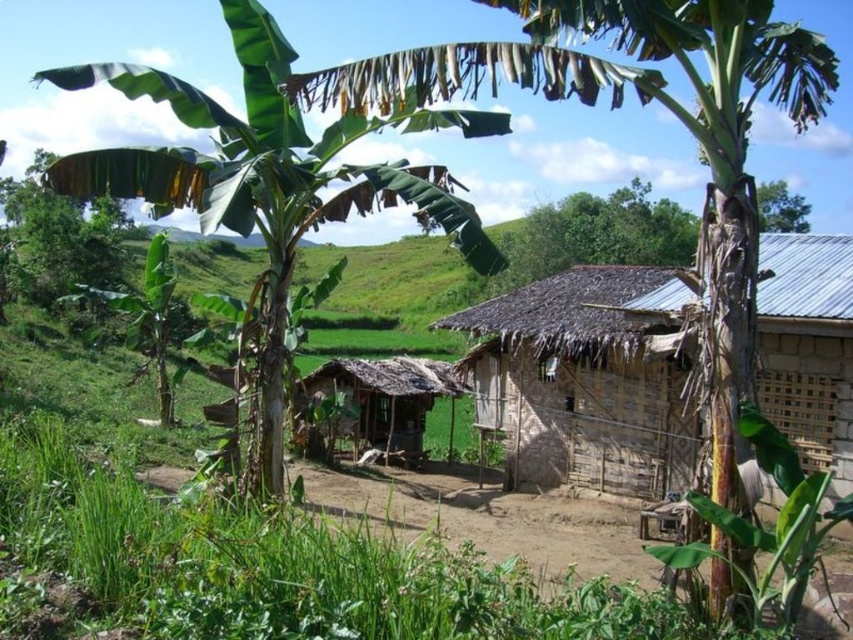
You are standing in the rural village and want to walk from the rusty corrugated metal hut at center to the green leafy tree at upper center. Which direction should you move towards?

You should move towards the right since the rusty corrugated metal hut at center is to the left of green leafy tree at upper center, so moving right would take you towards the tree.

You are a hiker who has just arrived at this rural village. You need to set up a tent between the brown thatch hut at center and the green leafy tree at upper center. The tent requires a minimum of 25 meters of space to be safely pitched. Based on the distance provided, will you be able to pitch your tent in this location?

The distance between the brown thatch hut at center and the green leafy tree at upper center is 24.39 meters, which is less than the required 25 meters. Therefore, you will not be able to safely pitch your tent in this location.